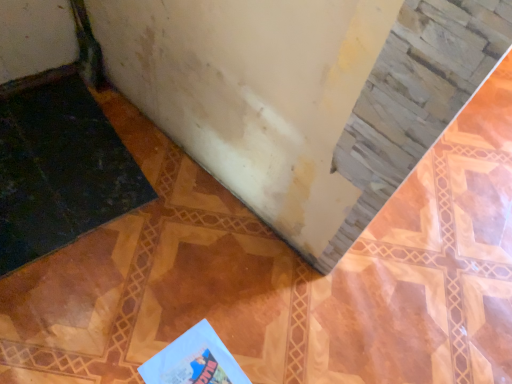
Question: Is black rubber doormat at lower left surrounding light blue paper at lower center?

Choices:
 (A) yes
 (B) no

Answer: (B)

Question: From a real-world perspective, does black rubber doormat at lower left stand above light blue paper at lower center?

Choices:
 (A) yes
 (B) no

Answer: (B)

Question: Can you confirm if black rubber doormat at lower left is thinner than light blue paper at lower center?

Choices:
 (A) no
 (B) yes

Answer: (A)

Question: Considering the relative sizes of black rubber doormat at lower left and light blue paper at lower center in the image provided, is black rubber doormat at lower left bigger than light blue paper at lower center?

Choices:
 (A) yes
 (B) no

Answer: (A)

Question: Can you confirm if black rubber doormat at lower left is shorter than light blue paper at lower center?

Choices:
 (A) yes
 (B) no

Answer: (B)

Question: From the image's perspective, is black rubber doormat at lower left located beneath light blue paper at lower center?

Choices:
 (A) no
 (B) yes

Answer: (A)

Question: Can you confirm if light blue paper at lower center is bigger than black rubber doormat at lower left?

Choices:
 (A) no
 (B) yes

Answer: (A)

Question: Considering the relative sizes of light blue paper at lower center and black rubber doormat at lower left in the image provided, is light blue paper at lower center taller than black rubber doormat at lower left?

Choices:
 (A) yes
 (B) no

Answer: (B)

Question: From the image's perspective, is light blue paper at lower center located above black rubber doormat at lower left?

Choices:
 (A) no
 (B) yes

Answer: (A)

Question: Are light blue paper at lower center and black rubber doormat at lower left beside each other?

Choices:
 (A) no
 (B) yes

Answer: (A)

Question: Is light blue paper at lower center facing away from black rubber doormat at lower left?

Choices:
 (A) yes
 (B) no

Answer: (B)

Question: Does light blue paper at lower center have a lesser width compared to black rubber doormat at lower left?

Choices:
 (A) yes
 (B) no

Answer: (A)

Question: Visually, is light blue paper at lower center positioned to the left or to the right of black rubber doormat at lower left?

Choices:
 (A) right
 (B) left

Answer: (A)